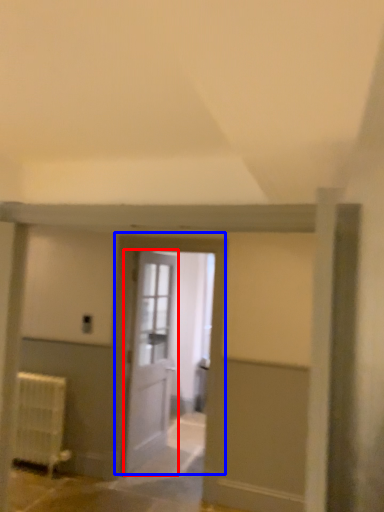
Question: Which point is further to the camera, door (highlighted by a red box) or door (highlighted by a blue box)?

Choices:
 (A) door
 (B) door

Answer: (A)